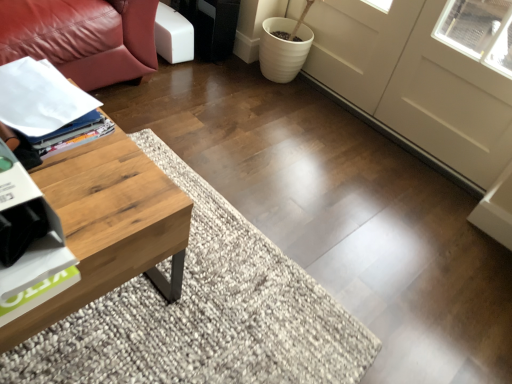
Identify the location of vacant space situated on the left part of white matte screen door at center. (260, 108).